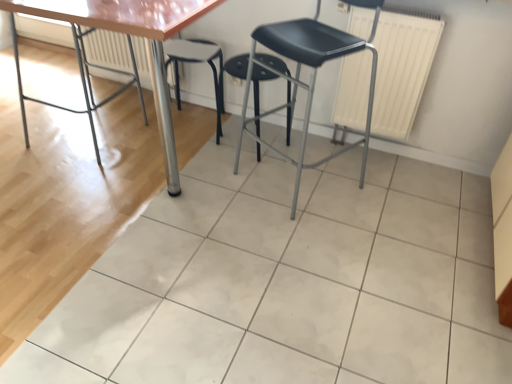
The image size is (512, 384). Identify the location of vacant space situated above white glossy tile at center (from a real-world perspective). (182, 186).